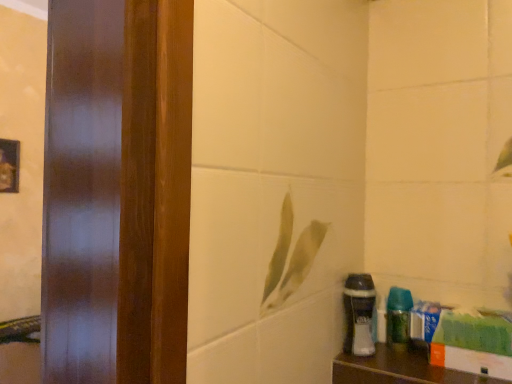
In order to face wooden shelf at lower right, should I rotate leftwards or rightwards?

You should look right and rotate roughly 21.536 degrees.

What do you see at coordinates (400, 369) in the screenshot?
I see `wooden shelf at lower right` at bounding box center [400, 369].

This screenshot has width=512, height=384. What do you see at coordinates (398, 316) in the screenshot?
I see `green glossy spray bottle at lower right` at bounding box center [398, 316].

Find the location of a particular element. This screenshot has width=512, height=384. white matte shaving cream at lower right is located at coordinates (359, 314).

This screenshot has height=384, width=512. I want to click on wooden shelf at lower right, so click(x=400, y=369).

Which is behind, point (404, 319) or point (356, 277)?

Point (356, 277)

Would you say green glossy spray bottle at lower right contains white matte shaving cream at lower right?

Definitely not — white matte shaving cream at lower right is not inside green glossy spray bottle at lower right.

In terms of height, does green glossy spray bottle at lower right look taller or shorter compared to white matte shaving cream at lower right?

In the image, green glossy spray bottle at lower right appears to be shorter than white matte shaving cream at lower right.

Is wooden shelf at lower right not near green glossy spray bottle at lower right?

No.

In the scene shown: Can you confirm if wooden shelf at lower right is positioned to the left of green glossy spray bottle at lower right?

No.

In the scene shown: Is green glossy spray bottle at lower right at the back of wooden shelf at lower right?

That's not correct — wooden shelf at lower right is not looking away from green glossy spray bottle at lower right.

The height and width of the screenshot is (384, 512). In order to click on furniture below the green glossy spray bottle at lower right (from a real-world perspective) in this screenshot , I will do 400,369.

Is wooden shelf at lower right to the left of white matte shaving cream at lower right from the viewer's perspective?

No, wooden shelf at lower right is not to the left of white matte shaving cream at lower right.

Considering the relative sizes of wooden shelf at lower right and white matte shaving cream at lower right in the image provided, is wooden shelf at lower right wider than white matte shaving cream at lower right?

Yes, wooden shelf at lower right is wider than white matte shaving cream at lower right.

In the scene shown: From the image's perspective, is wooden shelf at lower right located above white matte shaving cream at lower right?

Actually, wooden shelf at lower right appears below white matte shaving cream at lower right in the image.

Would you say wooden shelf at lower right is inside or outside white matte shaving cream at lower right?

The correct answer is: outside.

Considering the positions of objects green glossy spray bottle at lower right and wooden shelf at lower right in the image provided, who is in front, green glossy spray bottle at lower right or wooden shelf at lower right?

wooden shelf at lower right is closer to the camera.

From a real-world perspective, which is physically below, green glossy spray bottle at lower right or wooden shelf at lower right?

wooden shelf at lower right, from a real-world perspective.

Are green glossy spray bottle at lower right and wooden shelf at lower right located far from each other?

That's not correct — green glossy spray bottle at lower right is a little close to wooden shelf at lower right.

Considering the relative sizes of green glossy spray bottle at lower right and wooden shelf at lower right in the image provided, is green glossy spray bottle at lower right thinner than wooden shelf at lower right?

Correct, the width of green glossy spray bottle at lower right is less than that of wooden shelf at lower right.

Is white matte shaving cream at lower right not close to green glossy spray bottle at lower right?

No, white matte shaving cream at lower right is not far from green glossy spray bottle at lower right.

How far apart are white matte shaving cream at lower right and green glossy spray bottle at lower right?

The distance of white matte shaving cream at lower right from green glossy spray bottle at lower right is 3.79 inches.

From a real-world perspective, is white matte shaving cream at lower right above or below green glossy spray bottle at lower right?

white matte shaving cream at lower right is above green glossy spray bottle at lower right.

Considering the relative sizes of white matte shaving cream at lower right and green glossy spray bottle at lower right in the image provided, is white matte shaving cream at lower right thinner than green glossy spray bottle at lower right?

No.

Between white matte shaving cream at lower right and wooden shelf at lower right, which one has less height?

With less height is wooden shelf at lower right.

Is white matte shaving cream at lower right oriented towards wooden shelf at lower right?

No.

Is white matte shaving cream at lower right positioned beyond the bounds of wooden shelf at lower right?

Absolutely, white matte shaving cream at lower right is external to wooden shelf at lower right.

Locate an element on the screen. This screenshot has height=384, width=512. shaving cream above the green glossy spray bottle at lower right (from the image's perspective) is located at coordinates (359, 314).

Where is `furniture on the right of green glossy spray bottle at lower right`? furniture on the right of green glossy spray bottle at lower right is located at coordinates (400, 369).

Which object lies nearer to the anchor point wooden shelf at lower right, white matte shaving cream at lower right or green glossy spray bottle at lower right?

green glossy spray bottle at lower right is positioned closer to the anchor wooden shelf at lower right.

From the image, which object appears to be farther from wooden shelf at lower right, green glossy spray bottle at lower right or white matte shaving cream at lower right?

white matte shaving cream at lower right lies further to wooden shelf at lower right than the other object.

When comparing their distances from green glossy spray bottle at lower right, does white matte shaving cream at lower right or wooden shelf at lower right seem further?

The object further to green glossy spray bottle at lower right is wooden shelf at lower right.

Considering their positions, is green glossy spray bottle at lower right positioned closer to white matte shaving cream at lower right than wooden shelf at lower right?

The object closer to white matte shaving cream at lower right is green glossy spray bottle at lower right.

Looking at the image, which one is located closer to green glossy spray bottle at lower right, wooden shelf at lower right or white matte shaving cream at lower right?

white matte shaving cream at lower right lies closer to green glossy spray bottle at lower right than the other object.

Estimate the real-world distances between objects in this image. Which object is closer to white matte shaving cream at lower right, wooden shelf at lower right or green glossy spray bottle at lower right?

green glossy spray bottle at lower right.

The image size is (512, 384). What are the coordinates of `shaving cream between wooden shelf at lower right and green glossy spray bottle at lower right from front to back` in the screenshot? It's located at (359, 314).